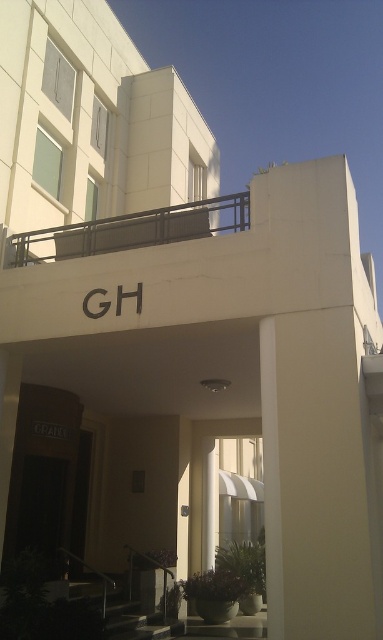
Which is more to the left, metallic gray balustrade at upper center or metallic rail at lower center?

metallic gray balustrade at upper center

Which is more to the right, metallic gray balustrade at upper center or metallic rail at lower center?

metallic rail at lower center

Does point (235, 202) come farther from viewer compared to point (163, 600)?

No, (235, 202) is in front of (163, 600).

The image size is (383, 640). Identify the location of metallic gray balustrade at upper center. (130, 230).